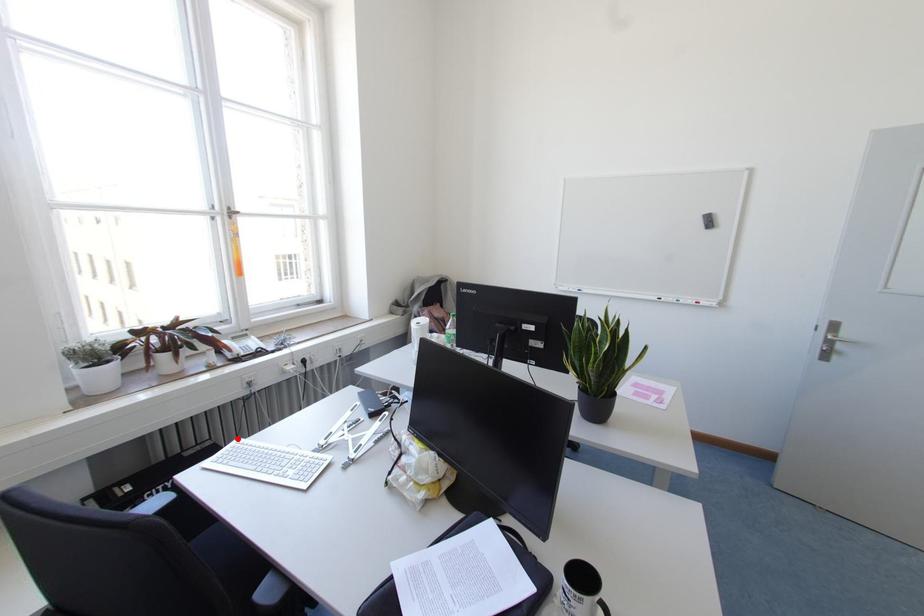
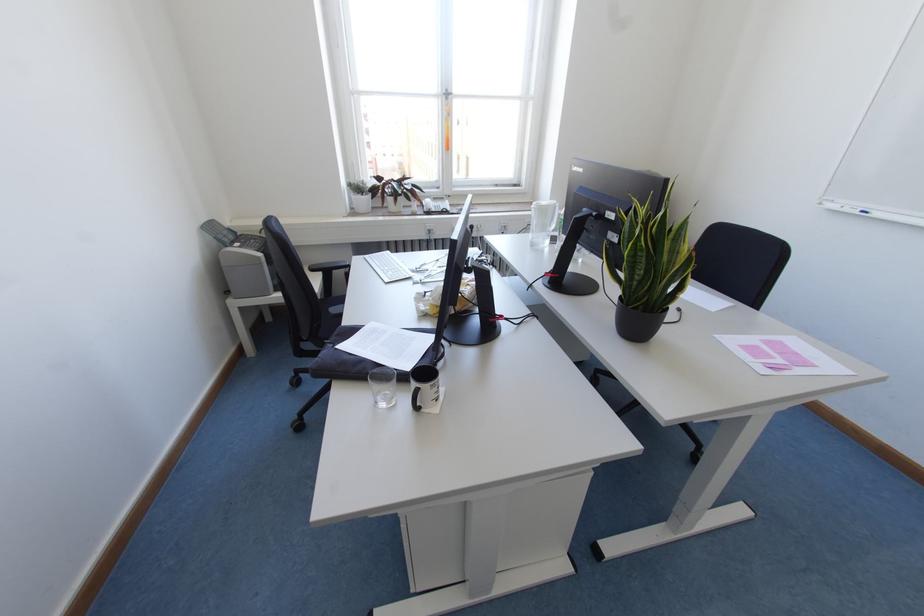
Where in the second image is the point corresponding to the highlighted location from the first image?

(387, 251)